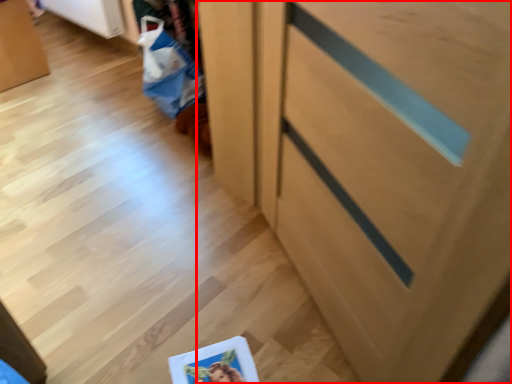
Question: Where is cabinetry (annotated by the red box) located in relation to shopping bag in the image?

Choices:
 (A) left
 (B) right

Answer: (B)